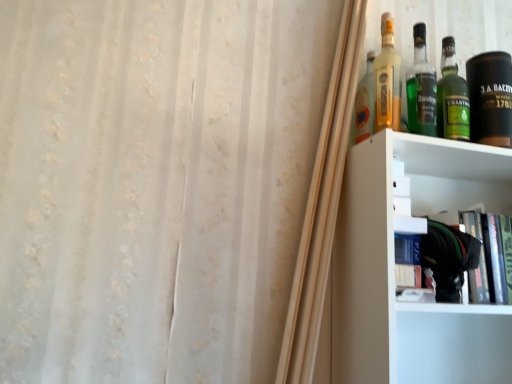
Question: Considering the relative positions of black leather canister at upper right and translucent glass bottle at upper right, which ranks as the 1th bottle in left-to-right order, in the image provided, is black leather canister at upper right to the right of translucent glass bottle at upper right, which ranks as the 1th bottle in left-to-right order, from the viewer's perspective?

Choices:
 (A) no
 (B) yes

Answer: (B)

Question: From the image's perspective, does black leather canister at upper right appear higher than translucent glass bottle at upper right, the 4th bottle in the right-to-left sequence?

Choices:
 (A) yes
 (B) no

Answer: (B)

Question: From a real-world perspective, does black leather canister at upper right stand above translucent glass bottle at upper right, which ranks as the 1th bottle in left-to-right order?

Choices:
 (A) yes
 (B) no

Answer: (B)

Question: Is the surface of black leather canister at upper right in direct contact with translucent glass bottle at upper right, which ranks as the 1th bottle in left-to-right order?

Choices:
 (A) yes
 (B) no

Answer: (B)

Question: Can you confirm if black leather canister at upper right is wider than translucent glass bottle at upper right, the 4th bottle in the right-to-left sequence?

Choices:
 (A) yes
 (B) no

Answer: (A)

Question: Is black leather canister at upper right positioned beyond the bounds of translucent glass bottle at upper right, which ranks as the 1th bottle in left-to-right order?

Choices:
 (A) no
 (B) yes

Answer: (B)

Question: Is green glass bottle at upper right, acting as the 4th bottle starting from the left, looking in the opposite direction of translucent glass bottle at upper right, marked as the 3th bottle in a right-to-left arrangement?

Choices:
 (A) no
 (B) yes

Answer: (A)

Question: Is green glass bottle at upper right, the first bottle viewed from the right, behind translucent glass bottle at upper right, marked as the 3th bottle in a right-to-left arrangement?

Choices:
 (A) no
 (B) yes

Answer: (B)

Question: From a real-world perspective, does green glass bottle at upper right, acting as the 4th bottle starting from the left, stand above translucent glass bottle at upper right, marked as the 3th bottle in a right-to-left arrangement?

Choices:
 (A) no
 (B) yes

Answer: (A)

Question: Could you tell me if green glass bottle at upper right, acting as the 4th bottle starting from the left, is turned towards translucent glass bottle at upper right, the 2th bottle positioned from the left?

Choices:
 (A) no
 (B) yes

Answer: (A)

Question: Is there a large distance between green glass bottle at upper right, acting as the 4th bottle starting from the left, and translucent glass bottle at upper right, the 2th bottle positioned from the left?

Choices:
 (A) no
 (B) yes

Answer: (A)

Question: Considering the relative sizes of green glass bottle at upper right, acting as the 4th bottle starting from the left, and translucent glass bottle at upper right, the 2th bottle positioned from the left, in the image provided, is green glass bottle at upper right, acting as the 4th bottle starting from the left, bigger than translucent glass bottle at upper right, the 2th bottle positioned from the left,?

Choices:
 (A) yes
 (B) no

Answer: (B)

Question: Can you confirm if hardcover book at upper right is thinner than translucent glass bottle at upper right, marked as the 3th bottle in a right-to-left arrangement?

Choices:
 (A) yes
 (B) no

Answer: (B)